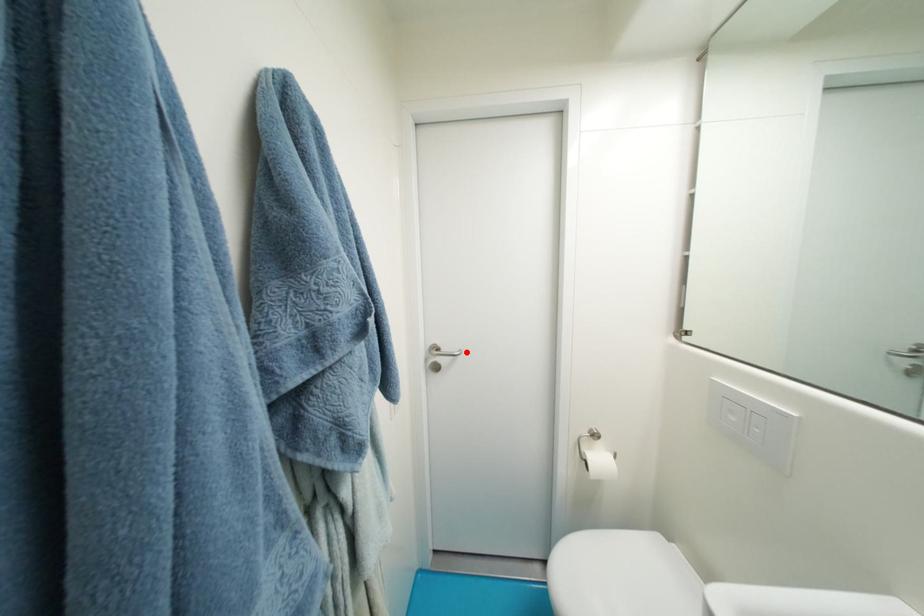
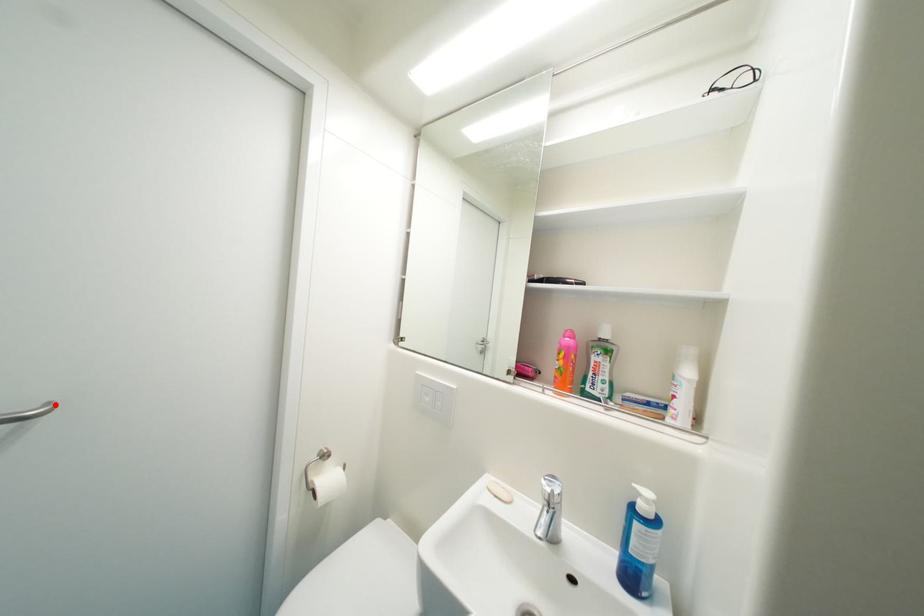
I am providing you with two images of the same scene from different viewpoints. A red point is marked on the first image and another point is marked on the second image. Is the marked point in image1 the same physical position as the marked point in image2?

Yes